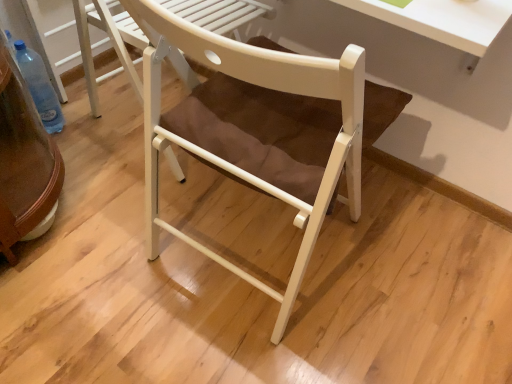
Question: Is transparent plastic bottle at lower left surrounding white matte chair at center, the 2th chair when ordered from front to back?

Choices:
 (A) yes
 (B) no

Answer: (B)

Question: Is transparent plastic bottle at lower left not near white matte chair at center, positioned as the 1th chair in back-to-front order?

Choices:
 (A) yes
 (B) no

Answer: (B)

Question: Is transparent plastic bottle at lower left thinner than white matte chair at center, positioned as the 1th chair in back-to-front order?

Choices:
 (A) no
 (B) yes

Answer: (B)

Question: Considering the relative sizes of transparent plastic bottle at lower left and white matte chair at center, positioned as the 1th chair in back-to-front order, in the image provided, is transparent plastic bottle at lower left wider than white matte chair at center, positioned as the 1th chair in back-to-front order,?

Choices:
 (A) no
 (B) yes

Answer: (A)

Question: Is white matte chair at center, positioned as the 1th chair in back-to-front order, at the back of transparent plastic bottle at lower left?

Choices:
 (A) no
 (B) yes

Answer: (A)

Question: From the image's perspective, is transparent plastic bottle at lower left above or below white wood chair at center, which is counted as the second chair, starting from the back?

Choices:
 (A) below
 (B) above

Answer: (B)

Question: In terms of height, does transparent plastic bottle at lower left look taller or shorter compared to white wood chair at center, arranged as the 1th chair when viewed from the front?

Choices:
 (A) short
 (B) tall

Answer: (A)

Question: From a real-world perspective, relative to white wood chair at center, which is counted as the second chair, starting from the back, is transparent plastic bottle at lower left vertically above or below?

Choices:
 (A) above
 (B) below

Answer: (B)

Question: Is transparent plastic bottle at lower left to the left or to the right of white wood chair at center, which is counted as the second chair, starting from the back, in the image?

Choices:
 (A) left
 (B) right

Answer: (A)

Question: Is transparent plastic bottle at lower left bigger or smaller than white matte chair at center, the 2th chair when ordered from front to back?

Choices:
 (A) small
 (B) big

Answer: (A)

Question: Considering their positions, is transparent plastic bottle at lower left located in front of or behind white matte chair at center, the 2th chair when ordered from front to back?

Choices:
 (A) front
 (B) behind

Answer: (B)

Question: In terms of height, does transparent plastic bottle at lower left look taller or shorter compared to white matte chair at center, the 2th chair when ordered from front to back?

Choices:
 (A) short
 (B) tall

Answer: (A)

Question: Does point (53, 109) appear closer or farther from the camera than point (205, 18)?

Choices:
 (A) closer
 (B) farther

Answer: (B)

Question: Is white matte chair at center, the 2th chair when ordered from front to back, taller or shorter than white wood chair at center, arranged as the 1th chair when viewed from the front?

Choices:
 (A) tall
 (B) short

Answer: (B)

Question: From a real-world perspective, is white matte chair at center, positioned as the 1th chair in back-to-front order, above or below white wood chair at center, which is counted as the second chair, starting from the back?

Choices:
 (A) below
 (B) above

Answer: (A)